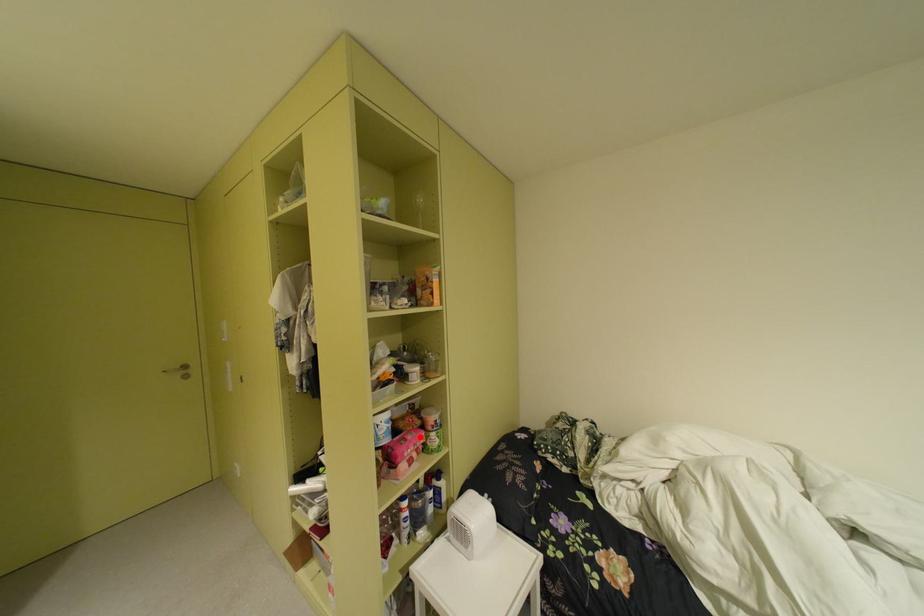
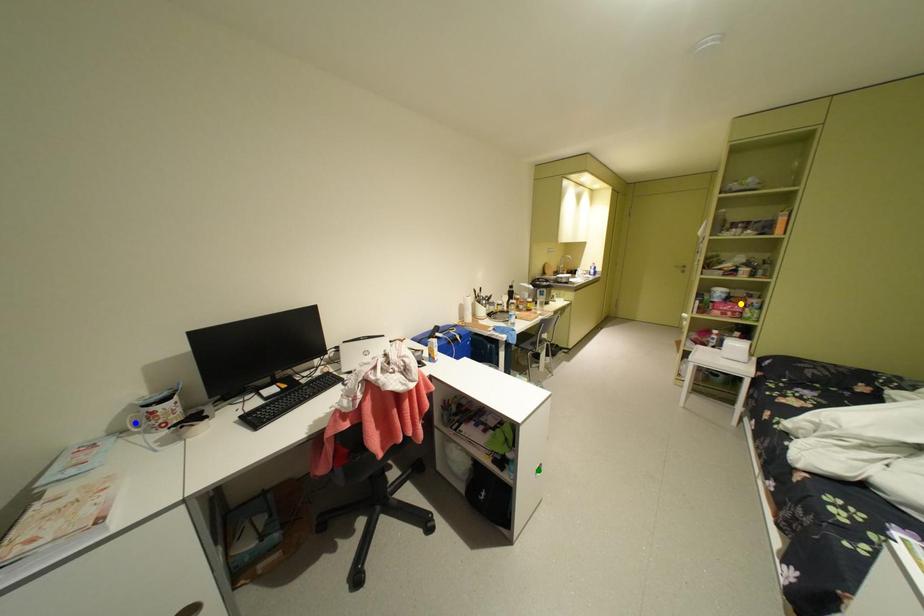
Question: I am providing you with two images of the same scene from different viewpoints. A red point is marked on the first image. You are given multiple points on the second image. In image 2, which mark is for the same physical point as the one in image 1?

Choices:
 (A) green point
 (B) yellow point
 (C) blue point

Answer: (B)